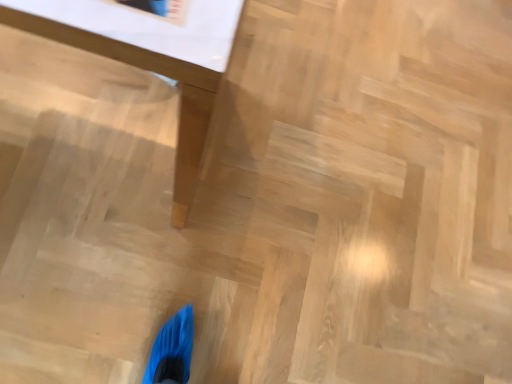
The height and width of the screenshot is (384, 512). I want to click on vacant space underneath wooden table at upper left (from a real-world perspective), so click(x=91, y=114).